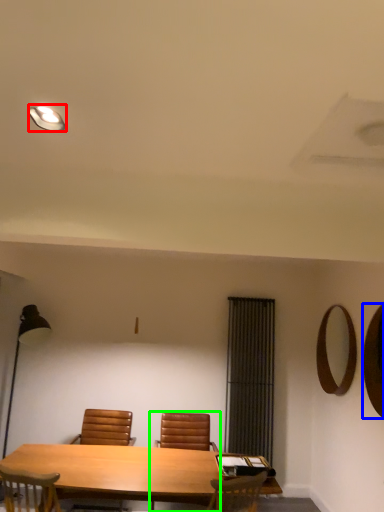
Question: Estimate the real-world distances between objects in this image. Which object is closer to lighting (highlighted by a red box), mirror (highlighted by a blue box) or chair (highlighted by a green box)?

Choices:
 (A) mirror
 (B) chair

Answer: (A)